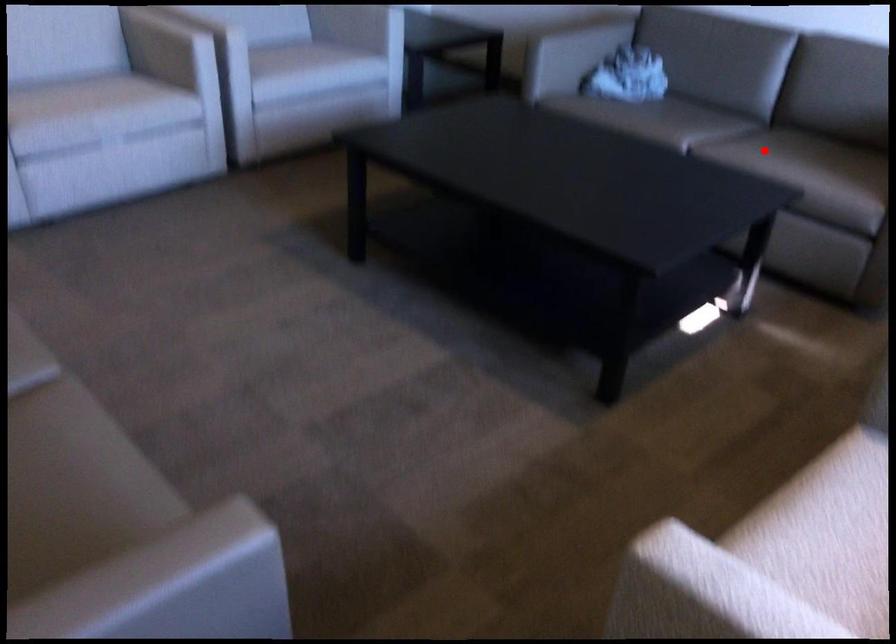
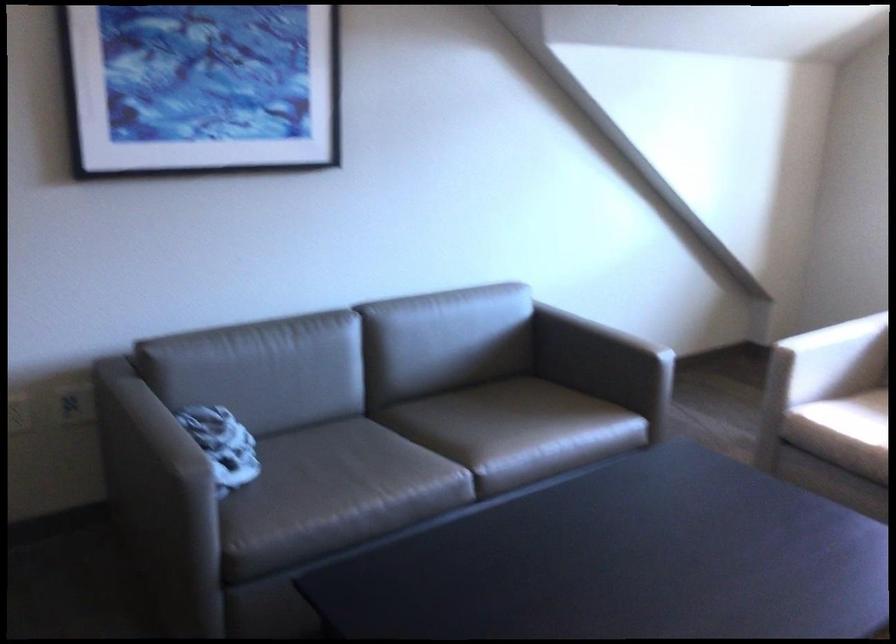
The point at the highlighted location is marked in the first image. Where is the corresponding point in the second image?

(497, 430)